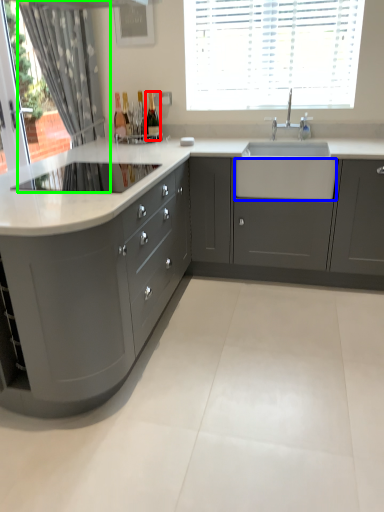
Question: Which is nearer to the bottle (highlighted by a red box)? drawer (highlighted by a blue box) or curtain (highlighted by a green box).

Choices:
 (A) drawer
 (B) curtain

Answer: (B)